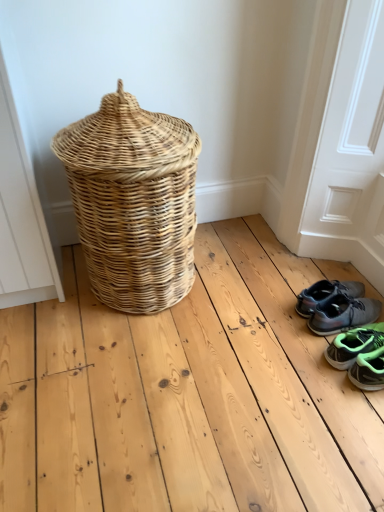
Question: Is gray synthetic sneakers at lower right, positioned as the first footwear in back-to-front order, positioned with its back to natural wicker basket at left?

Choices:
 (A) yes
 (B) no

Answer: (B)

Question: From a real-world perspective, does gray synthetic sneakers at lower right, which is the 3th footwear from front to back, stand above natural wicker basket at left?

Choices:
 (A) yes
 (B) no

Answer: (B)

Question: Is gray synthetic sneakers at lower right, which is the 3th footwear from front to back, thinner than natural wicker basket at left?

Choices:
 (A) yes
 (B) no

Answer: (A)

Question: Does gray synthetic sneakers at lower right, positioned as the first footwear in back-to-front order, have a greater height compared to natural wicker basket at left?

Choices:
 (A) no
 (B) yes

Answer: (A)

Question: From their relative heights in the image, would you say gray fabric sneakers at lower right, which is counted as the 2th footwear, starting from the front, is taller or shorter than natural wicker basket at left?

Choices:
 (A) tall
 (B) short

Answer: (B)

Question: Is gray fabric sneakers at lower right, which appears as the second footwear when viewed from the back, to the left or to the right of natural wicker basket at left in the image?

Choices:
 (A) left
 (B) right

Answer: (B)

Question: Is gray fabric sneakers at lower right, which appears as the second footwear when viewed from the back, bigger or smaller than natural wicker basket at left?

Choices:
 (A) small
 (B) big

Answer: (A)

Question: From the image's perspective, is gray fabric sneakers at lower right, which is counted as the 2th footwear, starting from the front, positioned above or below natural wicker basket at left?

Choices:
 (A) above
 (B) below

Answer: (B)

Question: Visually, is natural wicker basket at left positioned to the left or to the right of neon green synthetic sneakers at lower right, marked as the 1th footwear in a front-to-back arrangement?

Choices:
 (A) left
 (B) right

Answer: (A)

Question: From a real-world perspective, is natural wicker basket at left above or below neon green synthetic sneakers at lower right, marked as the 1th footwear in a front-to-back arrangement?

Choices:
 (A) below
 (B) above

Answer: (B)

Question: In the image, is natural wicker basket at left positioned in front of or behind neon green synthetic sneakers at lower right, marked as the 1th footwear in a front-to-back arrangement?

Choices:
 (A) behind
 (B) front

Answer: (B)

Question: Is natural wicker basket at left taller or shorter than neon green synthetic sneakers at lower right, arranged as the third footwear when viewed from the back?

Choices:
 (A) short
 (B) tall

Answer: (B)

Question: Based on their positions, is neon green synthetic sneakers at lower right, arranged as the third footwear when viewed from the back, located to the left or right of gray synthetic sneakers at lower right, positioned as the first footwear in back-to-front order?

Choices:
 (A) left
 (B) right

Answer: (B)

Question: Does point (380, 373) appear closer or farther from the camera than point (347, 308)?

Choices:
 (A) farther
 (B) closer

Answer: (B)